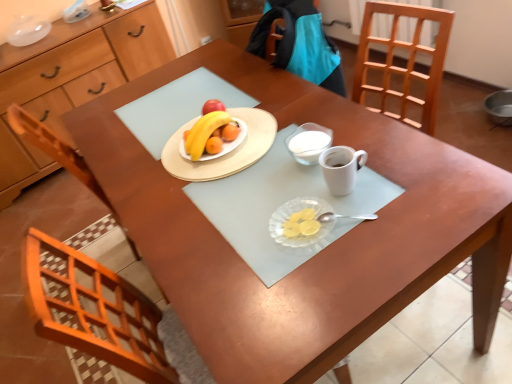
The image size is (512, 384). I want to click on blank space above matte wooden plate at center (from a real-world perspective), so click(215, 138).